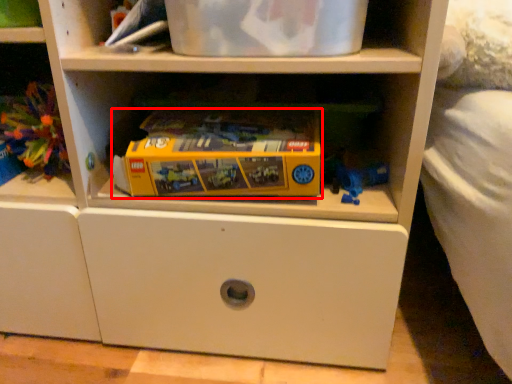
Question: From the image's perspective, where is toy (annotated by the red box) located relative to toy?

Choices:
 (A) above
 (B) below

Answer: (B)